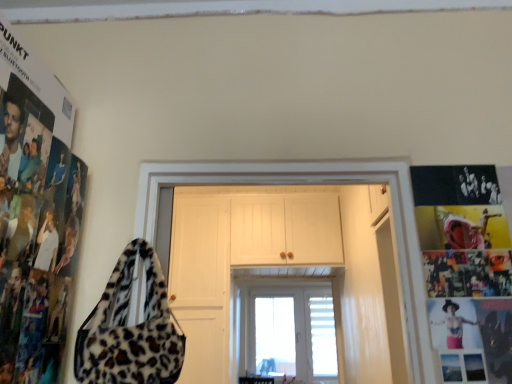
Question: In the image, is white wooden door at center positioned in front of or behind black matte poster at right?

Choices:
 (A) behind
 (B) front

Answer: (A)

Question: Based on their sizes in the image, would you say white wooden door at center is bigger or smaller than black matte poster at right?

Choices:
 (A) big
 (B) small

Answer: (A)

Question: Estimate the real-world distances between objects in this image. Which object is farther from the black matte poster at right?

Choices:
 (A) transparent glass door at center
 (B) white wooden door at center
 (C) leopard print fabric shoulder bag at left
 (D) leather-like red pants at lower right

Answer: (A)

Question: Estimate the real-world distances between objects in this image. Which object is closer to the black matte poster at right?

Choices:
 (A) transparent glass door at center
 (B) leather-like red pants at lower right
 (C) leopard print fabric shoulder bag at left
 (D) white wooden door at center

Answer: (B)